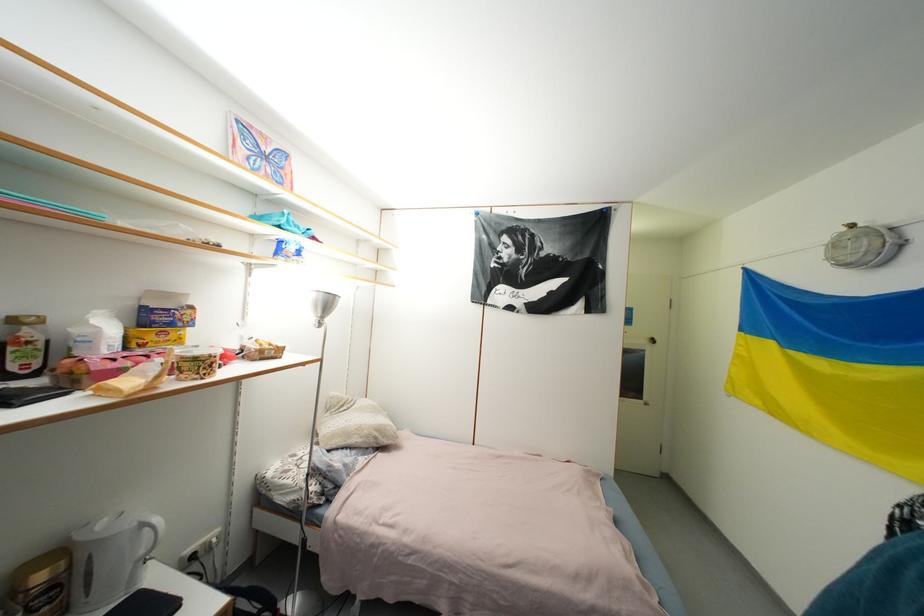
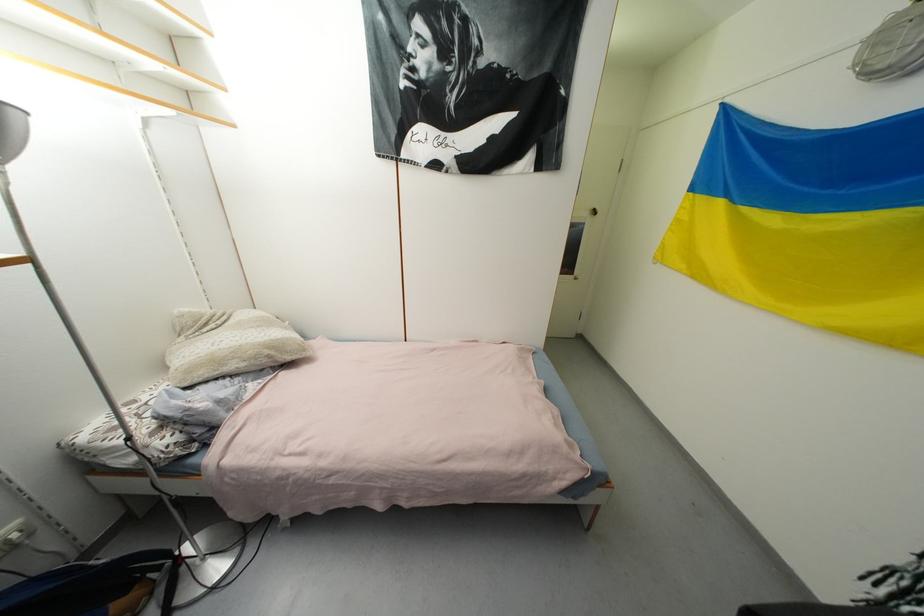
Question: In a continuous first-person perspective shot, in which direction is the camera moving?

Choices:
 (A) Left
 (B) Right
 (C) Forward
 (D) Backward

Answer: (C)